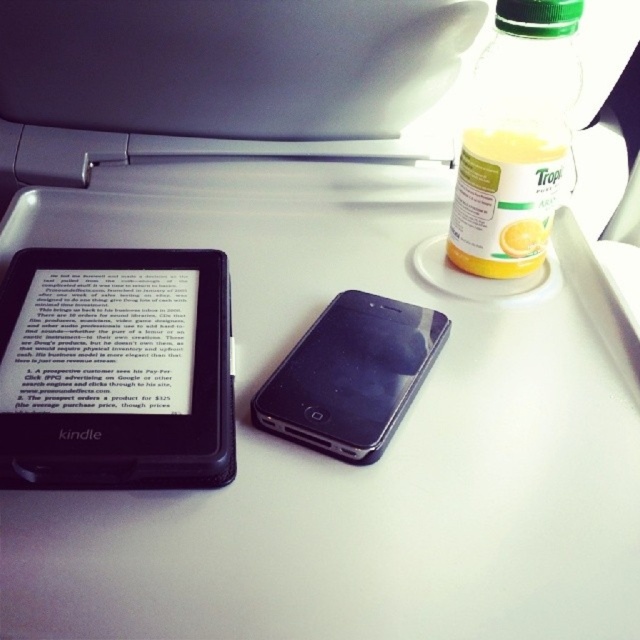
Looking at this image, does white matte table at center appear over translucent plastic bottle at upper right?

No.

The image size is (640, 640). What are the coordinates of `white matte table at center` in the screenshot? It's located at (342, 464).

I want to click on white matte table at center, so click(x=342, y=464).

Identify the location of white matte table at center. (342, 464).

Between white matte table at center and translucent plastic bottle of orange juice at upper right, which one has more height?

white matte table at center is taller.

I want to click on white matte table at center, so click(342, 464).

Is black matte kindle at left thinner than black matte/ipad at center?

In fact, black matte kindle at left might be wider than black matte/ipad at center.

Which of these two, black matte kindle at left or black matte/ipad at center, stands shorter?

black matte/ipad at center

Where is `black matte kindle at left`? black matte kindle at left is located at coordinates (115, 369).